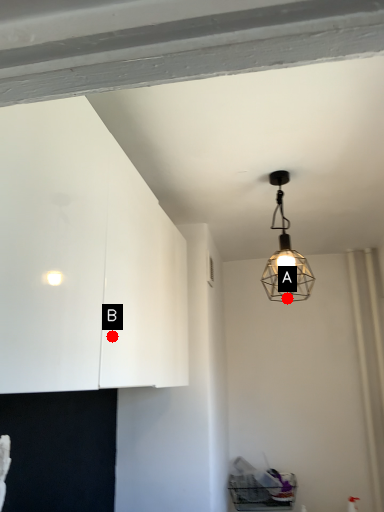
Question: Two points are circled on the image, labeled by A and B beside each circle. Which point is farther to the camera?

Choices:
 (A) A is further
 (B) B is further

Answer: (A)